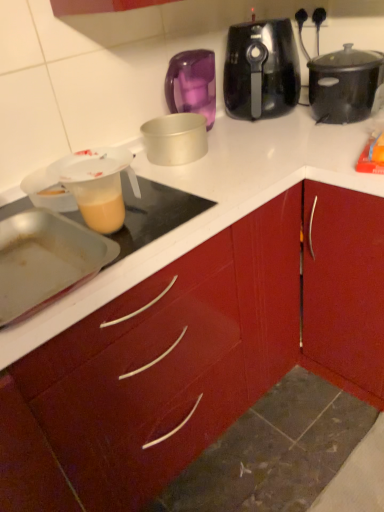
How much space does black plastic slow cooker at upper center, marked as the second slow cooker in a right-to-left arrangement, occupy horizontally?

black plastic slow cooker at upper center, marked as the second slow cooker in a right-to-left arrangement, is 9.72 inches in width.

Locate an element on the screen. The image size is (384, 512). silver metallic cake pan at center, which is the third kitchen appliance in bottom-to-top order is located at coordinates (175, 138).

This screenshot has width=384, height=512. What do you see at coordinates (175, 138) in the screenshot? I see `silver metallic cake pan at center, the 3th kitchen appliance positioned from the front` at bounding box center [175, 138].

What do you see at coordinates (45, 261) in the screenshot? The width and height of the screenshot is (384, 512). I see `metallic silver baking pan at left, which is counted as the first kitchen appliance, starting from the front` at bounding box center [45, 261].

The height and width of the screenshot is (512, 384). What do you see at coordinates (98, 185) in the screenshot?
I see `translucent plastic measuring cup at left, the 2th kitchen appliance in the back-to-front sequence` at bounding box center [98, 185].

Find the location of a particular element. black plastic slow cooker at upper center, acting as the 1th slow cooker starting from the left is located at coordinates click(261, 70).

Which of these two, black plastic slow cooker at upper center, marked as the second slow cooker in a right-to-left arrangement, or metallic silver baking pan at left, the 3th kitchen appliance in the top-to-bottom sequence, is thinner?

black plastic slow cooker at upper center, marked as the second slow cooker in a right-to-left arrangement.

Is metallic silver baking pan at left, the 3th kitchen appliance when ordered from back to front, surrounded by black plastic slow cooker at upper center, marked as the second slow cooker in a right-to-left arrangement?

No, metallic silver baking pan at left, the 3th kitchen appliance when ordered from back to front, is not inside black plastic slow cooker at upper center, marked as the second slow cooker in a right-to-left arrangement.

Looking at this image, between black plastic slow cooker at upper center, marked as the second slow cooker in a right-to-left arrangement, and metallic silver baking pan at left, the 3th kitchen appliance when ordered from back to front, which one has less height?

metallic silver baking pan at left, the 3th kitchen appliance when ordered from back to front, is shorter.

Is point (235, 75) closer or farther from the camera than point (40, 231)?

Point (235, 75).

Could you measure the distance between black matte slow cooker at upper right, arranged as the 2th slow cooker when viewed from the left, and glossy wood cabinet at center?

black matte slow cooker at upper right, arranged as the 2th slow cooker when viewed from the left, and glossy wood cabinet at center are 67.74 centimeters apart.

Which is correct: black matte slow cooker at upper right, which appears as the first slow cooker when viewed from the right, is inside glossy wood cabinet at center, or outside of it?

black matte slow cooker at upper right, which appears as the first slow cooker when viewed from the right, is located beyond the bounds of glossy wood cabinet at center.

In the scene shown: Which object is further away from the camera, black matte slow cooker at upper right, arranged as the 2th slow cooker when viewed from the left, or glossy wood cabinet at center?

black matte slow cooker at upper right, arranged as the 2th slow cooker when viewed from the left, is further from the camera.

Is point (350, 76) less distant than point (349, 379)?

Yes.

Which of these two, silver metallic cake pan at center, which is the third kitchen appliance in bottom-to-top order, or translucent plastic measuring cup at left, marked as the 2th kitchen appliance in a front-to-back arrangement, stands taller?

silver metallic cake pan at center, which is the third kitchen appliance in bottom-to-top order, is taller.

Based on the photo, between silver metallic cake pan at center, which is the third kitchen appliance in bottom-to-top order, and translucent plastic measuring cup at left, the 2th kitchen appliance positioned from the bottom, which one appears on the left side from the viewer's perspective?

translucent plastic measuring cup at left, the 2th kitchen appliance positioned from the bottom.

Which point is more forward, (181, 120) or (115, 167)?

Point (115, 167)

Considering their positions, is silver metallic cake pan at center, the 3th kitchen appliance positioned from the front, located in front of or behind translucent plastic measuring cup at left, the 2th kitchen appliance positioned from the bottom?

Clearly, silver metallic cake pan at center, the 3th kitchen appliance positioned from the front, is behind translucent plastic measuring cup at left, the 2th kitchen appliance positioned from the bottom.

Is glossy wood cabinet at center in front of or behind translucent plastic measuring cup at left, the 2th kitchen appliance positioned from the bottom, in the image?

Visually, glossy wood cabinet at center is located in front of translucent plastic measuring cup at left, the 2th kitchen appliance positioned from the bottom.

Which point is more forward, (x=51, y=360) or (x=116, y=167)?

Point (x=51, y=360)

Identify the location of kitchen appliance that is the 2nd object located behind the glossy wood cabinet at center. The image size is (384, 512). (98, 185).

In the scene shown: Is glossy wood cabinet at center not within translucent plastic measuring cup at left, the 2th kitchen appliance positioned from the top?

glossy wood cabinet at center is positioned outside translucent plastic measuring cup at left, the 2th kitchen appliance positioned from the top.

Is translucent plastic measuring cup at left, the 2th kitchen appliance positioned from the top, positioned before metallic silver baking pan at left, which is counted as the first kitchen appliance, starting from the front?

No, the depth of translucent plastic measuring cup at left, the 2th kitchen appliance positioned from the top, is greater than that of metallic silver baking pan at left, which is counted as the first kitchen appliance, starting from the front.

From the picture: Considering the sizes of objects translucent plastic measuring cup at left, the 2th kitchen appliance positioned from the top, and metallic silver baking pan at left, which is counted as the first kitchen appliance, starting from the front, in the image provided, who is smaller, translucent plastic measuring cup at left, the 2th kitchen appliance positioned from the top, or metallic silver baking pan at left, which is counted as the first kitchen appliance, starting from the front,?

With smaller size is translucent plastic measuring cup at left, the 2th kitchen appliance positioned from the top.

Considering the relative sizes of translucent plastic measuring cup at left, marked as the 2th kitchen appliance in a front-to-back arrangement, and metallic silver baking pan at left, the 3th kitchen appliance when ordered from back to front, in the image provided, is translucent plastic measuring cup at left, marked as the 2th kitchen appliance in a front-to-back arrangement, wider than metallic silver baking pan at left, the 3th kitchen appliance when ordered from back to front,?

No, translucent plastic measuring cup at left, marked as the 2th kitchen appliance in a front-to-back arrangement, is not wider than metallic silver baking pan at left, the 3th kitchen appliance when ordered from back to front.

From the image's perspective, which object appears higher, translucent plastic measuring cup at left, marked as the 2th kitchen appliance in a front-to-back arrangement, or metallic silver baking pan at left, the 1th kitchen appliance ordered from the bottom?

translucent plastic measuring cup at left, marked as the 2th kitchen appliance in a front-to-back arrangement, is shown above in the image.

Does metallic silver baking pan at left, the 1th kitchen appliance ordered from the bottom, have a greater width compared to silver metallic cake pan at center, the first kitchen appliance positioned from the top?

Yes.

Considering the sizes of objects metallic silver baking pan at left, the 1th kitchen appliance ordered from the bottom, and silver metallic cake pan at center, arranged as the first kitchen appliance when viewed from the back, in the image provided, who is bigger, metallic silver baking pan at left, the 1th kitchen appliance ordered from the bottom, or silver metallic cake pan at center, arranged as the first kitchen appliance when viewed from the back,?

Bigger between the two is metallic silver baking pan at left, the 1th kitchen appliance ordered from the bottom.

Is metallic silver baking pan at left, the 3th kitchen appliance when ordered from back to front, not near silver metallic cake pan at center, arranged as the first kitchen appliance when viewed from the back?

That's not correct — metallic silver baking pan at left, the 3th kitchen appliance when ordered from back to front, is a little close to silver metallic cake pan at center, arranged as the first kitchen appliance when viewed from the back.

In terms of size, does translucent plastic measuring cup at left, the 2th kitchen appliance positioned from the top, appear bigger or smaller than black matte slow cooker at upper right, which appears as the first slow cooker when viewed from the right?

translucent plastic measuring cup at left, the 2th kitchen appliance positioned from the top, is smaller than black matte slow cooker at upper right, which appears as the first slow cooker when viewed from the right.

Considering their positions, is translucent plastic measuring cup at left, the 2th kitchen appliance in the back-to-front sequence, located in front of or behind black matte slow cooker at upper right, which appears as the first slow cooker when viewed from the right?

translucent plastic measuring cup at left, the 2th kitchen appliance in the back-to-front sequence, is in front of black matte slow cooker at upper right, which appears as the first slow cooker when viewed from the right.

From a real-world perspective, is translucent plastic measuring cup at left, marked as the 2th kitchen appliance in a front-to-back arrangement, below black matte slow cooker at upper right, arranged as the 2th slow cooker when viewed from the left?

Yes, from a real-world perspective, translucent plastic measuring cup at left, marked as the 2th kitchen appliance in a front-to-back arrangement, is under black matte slow cooker at upper right, arranged as the 2th slow cooker when viewed from the left.

Considering the points (82, 186) and (338, 80), which point is behind, point (82, 186) or point (338, 80)?

Point (338, 80)

This screenshot has width=384, height=512. What are the coordinates of `kitchen appliance that is the 3rd one when counting downward from the black plastic slow cooker at upper center, acting as the 1th slow cooker starting from the left (from the image's perspective)` in the screenshot? It's located at (45, 261).

Where is `cabinetry that appears in front of the black matte slow cooker at upper right, which appears as the first slow cooker when viewed from the right`? cabinetry that appears in front of the black matte slow cooker at upper right, which appears as the first slow cooker when viewed from the right is located at coordinates (199, 351).

From the image, which object appears to be nearer to metallic silver baking pan at left, the 3th kitchen appliance in the top-to-bottom sequence, black plastic slow cooker at upper center, acting as the 1th slow cooker starting from the left, or silver metallic cake pan at center, the 3th kitchen appliance positioned from the front?

silver metallic cake pan at center, the 3th kitchen appliance positioned from the front, is closer to metallic silver baking pan at left, the 3th kitchen appliance in the top-to-bottom sequence.

Which object lies nearer to the anchor point silver metallic cake pan at center, the 3th kitchen appliance positioned from the front, black matte slow cooker at upper right, which appears as the first slow cooker when viewed from the right, or glossy wood cabinet at center?

The object closer to silver metallic cake pan at center, the 3th kitchen appliance positioned from the front, is black matte slow cooker at upper right, which appears as the first slow cooker when viewed from the right.

Looking at the image, which one is located closer to translucent plastic measuring cup at left, the 2th kitchen appliance in the back-to-front sequence, glossy wood cabinet at center or metallic silver baking pan at left, the 1th kitchen appliance ordered from the bottom?

metallic silver baking pan at left, the 1th kitchen appliance ordered from the bottom, is positioned closer to the anchor translucent plastic measuring cup at left, the 2th kitchen appliance in the back-to-front sequence.

Looking at this image, based on their spatial positions, is silver metallic cake pan at center, the 3th kitchen appliance positioned from the front, or glossy wood cabinet at center closer to metallic silver baking pan at left, the 1th kitchen appliance ordered from the bottom?

glossy wood cabinet at center lies closer to metallic silver baking pan at left, the 1th kitchen appliance ordered from the bottom, than the other object.

From the image, which object appears to be farther from translucent plastic measuring cup at left, the 2th kitchen appliance positioned from the top, glossy wood cabinet at center or silver metallic cake pan at center, the first kitchen appliance positioned from the top?

glossy wood cabinet at center.

When comparing their distances from black matte slow cooker at upper right, arranged as the 2th slow cooker when viewed from the left, does translucent plastic measuring cup at left, the 2th kitchen appliance positioned from the bottom, or black plastic slow cooker at upper center, marked as the second slow cooker in a right-to-left arrangement, seem further?

Based on the image, translucent plastic measuring cup at left, the 2th kitchen appliance positioned from the bottom, appears to be further to black matte slow cooker at upper right, arranged as the 2th slow cooker when viewed from the left.

Considering their positions, is black plastic slow cooker at upper center, marked as the second slow cooker in a right-to-left arrangement, positioned further to metallic silver baking pan at left, the 3th kitchen appliance when ordered from back to front, than translucent plastic measuring cup at left, marked as the 2th kitchen appliance in a front-to-back arrangement?

black plastic slow cooker at upper center, marked as the second slow cooker in a right-to-left arrangement, is further to metallic silver baking pan at left, the 3th kitchen appliance when ordered from back to front.

Looking at the image, which one is located further to metallic silver baking pan at left, the 3th kitchen appliance in the top-to-bottom sequence, black plastic slow cooker at upper center, acting as the 1th slow cooker starting from the left, or glossy wood cabinet at center?

black plastic slow cooker at upper center, acting as the 1th slow cooker starting from the left, is positioned further to the anchor metallic silver baking pan at left, the 3th kitchen appliance in the top-to-bottom sequence.

You are a GUI agent. You are given a task and a screenshot of the screen. Output one action in this format:
    pyautogui.click(x=<x>, y=<y>)
    Task: Click on the kitchen appliance located between translucent plastic measuring cup at left, the 2th kitchen appliance in the back-to-front sequence, and black matte slow cooker at upper right, arranged as the 2th slow cooker when viewed from the left, in the left-right direction
    The width and height of the screenshot is (384, 512).
    Given the screenshot: What is the action you would take?
    tap(175, 138)

Find the location of a particular element. The height and width of the screenshot is (512, 384). slow cooker between silver metallic cake pan at center, arranged as the first kitchen appliance when viewed from the back, and black matte slow cooker at upper right, arranged as the 2th slow cooker when viewed from the left, in the horizontal direction is located at coordinates (261, 70).

Find the location of a particular element. The width and height of the screenshot is (384, 512). kitchen appliance located between metallic silver baking pan at left, the 1th kitchen appliance ordered from the bottom, and silver metallic cake pan at center, the 3th kitchen appliance positioned from the front, in the depth direction is located at coordinates (98, 185).

Locate an element on the screen. This screenshot has width=384, height=512. slow cooker situated between metallic silver baking pan at left, which is counted as the first kitchen appliance, starting from the front, and black matte slow cooker at upper right, which appears as the first slow cooker when viewed from the right, from left to right is located at coordinates (261, 70).